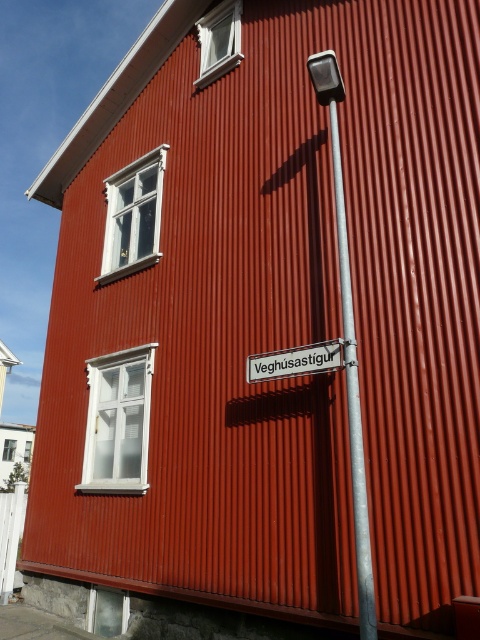
Is metallic silver pole at center to the right of metallic silver street sign at center from the viewer's perspective?

Indeed, metallic silver pole at center is positioned on the right side of metallic silver street sign at center.

Is metallic silver pole at center above metallic silver street sign at center?

Actually, metallic silver pole at center is below metallic silver street sign at center.

Is point (350, 461) closer to camera compared to point (310, 371)?

Yes, it is in front of point (310, 371).

Find the location of a particular element. The width and height of the screenshot is (480, 640). metallic silver pole at center is located at coordinates (352, 397).